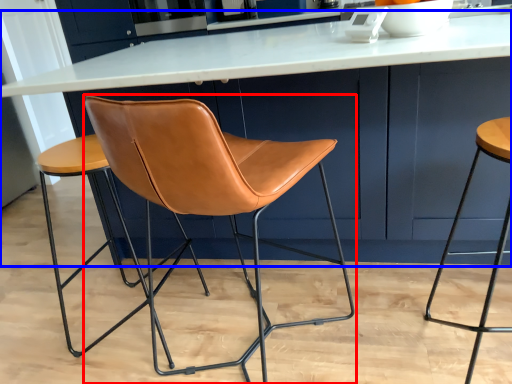
Question: Which point is further to the camera, chair (highlighted by a red box) or table (highlighted by a blue box)?

Choices:
 (A) chair
 (B) table

Answer: (B)